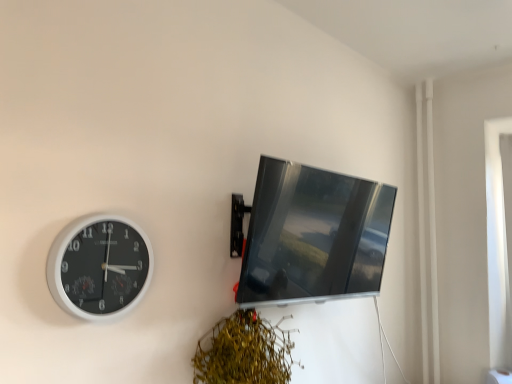
Question: Does white plastic clock at left have a lesser height compared to matte black monitor at upper right?

Choices:
 (A) no
 (B) yes

Answer: (B)

Question: From a real-world perspective, does white plastic clock at left stand above matte black monitor at upper right?

Choices:
 (A) yes
 (B) no

Answer: (B)

Question: Is white plastic clock at left in front of matte black monitor at upper right?

Choices:
 (A) yes
 (B) no

Answer: (A)

Question: Is white plastic clock at left at the left side of matte black monitor at upper right?

Choices:
 (A) no
 (B) yes

Answer: (B)

Question: From a real-world perspective, is white plastic clock at left located beneath matte black monitor at upper right?

Choices:
 (A) yes
 (B) no

Answer: (A)

Question: Is white plastic clock at left smaller than matte black monitor at upper right?

Choices:
 (A) yes
 (B) no

Answer: (A)

Question: Is green leafy plant at lower center not near matte black monitor at upper right?

Choices:
 (A) yes
 (B) no

Answer: (B)

Question: Is green leafy plant at lower center taller than matte black monitor at upper right?

Choices:
 (A) no
 (B) yes

Answer: (A)

Question: From the image's perspective, does green leafy plant at lower center appear lower than matte black monitor at upper right?

Choices:
 (A) no
 (B) yes

Answer: (B)

Question: Can you confirm if green leafy plant at lower center is positioned to the right of matte black monitor at upper right?

Choices:
 (A) yes
 (B) no

Answer: (B)

Question: Could matte black monitor at upper right be considered to be inside green leafy plant at lower center?

Choices:
 (A) yes
 (B) no

Answer: (B)

Question: Does green leafy plant at lower center have a lesser height compared to matte black monitor at upper right?

Choices:
 (A) yes
 (B) no

Answer: (A)

Question: Does white plastic clock at left appear on the right side of green leafy plant at lower center?

Choices:
 (A) no
 (B) yes

Answer: (A)